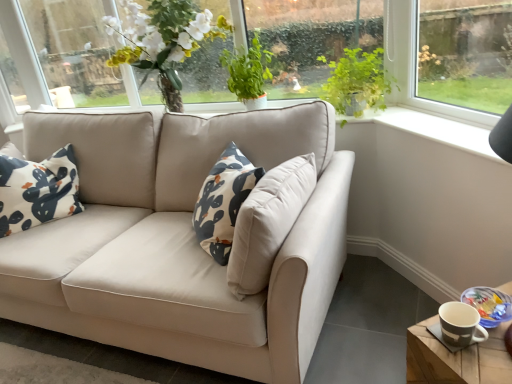
The height and width of the screenshot is (384, 512). I want to click on vacant area that is in front of matte brown mug at lower right, so click(481, 365).